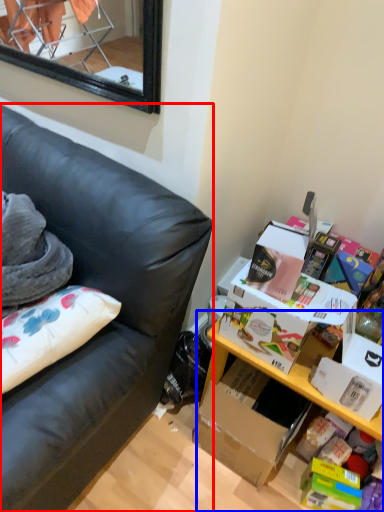
Question: Which of the following is the farthest to the observer, studio couch (highlighted by a red box) or table (highlighted by a blue box)?

Choices:
 (A) studio couch
 (B) table

Answer: (B)